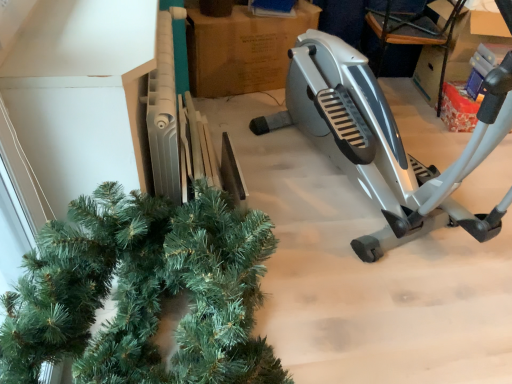
At what (x,y) coordinates should I click in order to perform the action: click on free region under silver metallic stationary bicycle at right (from a real-world perspective). Please return your answer as a coordinate pair (x, y). The image size is (512, 384). Looking at the image, I should click on (360, 200).